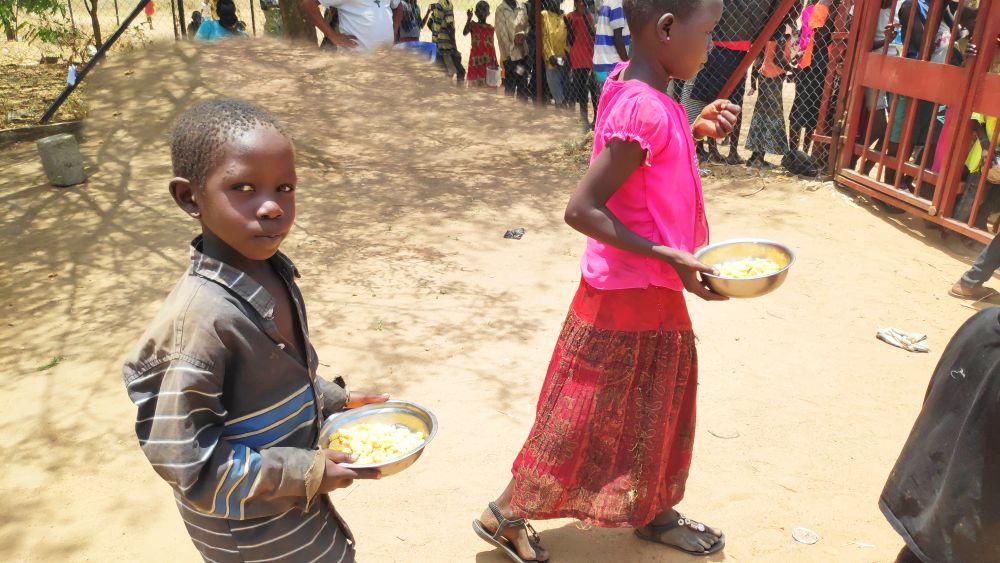
Where is `plate`? plate is located at coordinates (395, 427), (757, 269).